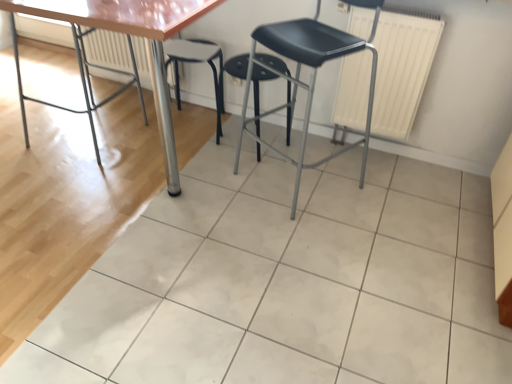
I want to click on vacant space in front of matte black stool at center, so click(320, 246).